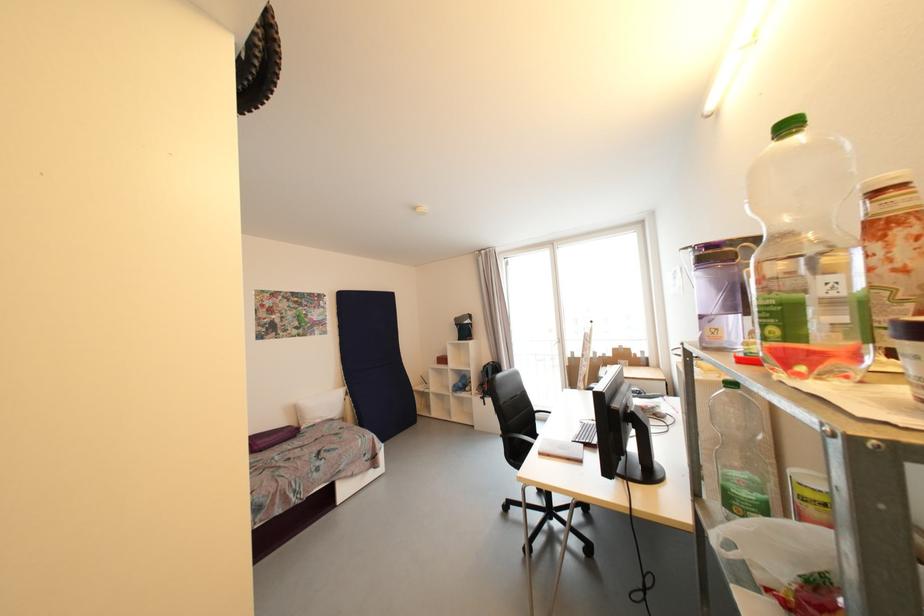
Where would you lift the empty glass jar? Please return your answer as a coordinate pair (x, y).

(807, 257)